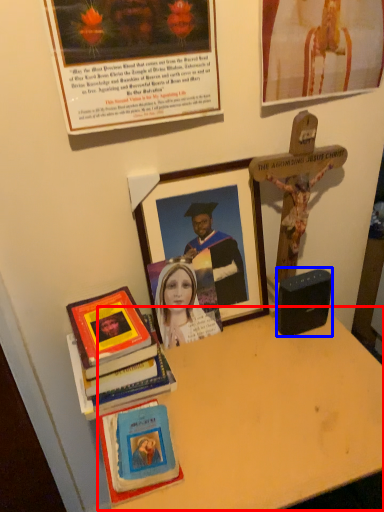
Question: Which object is further to the camera taking this photo, table (highlighted by a red box) or speaker (highlighted by a blue box)?

Choices:
 (A) table
 (B) speaker

Answer: (B)